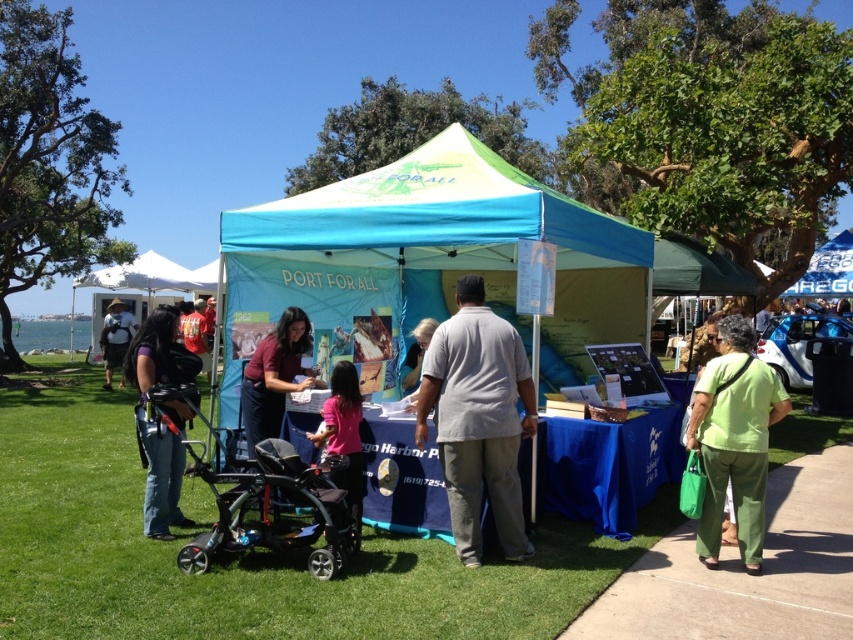
Question: Which object is the closest to the blue fabric tent at center?

Choices:
 (A) green fabric bag at lower right
 (B) matte black backpack at center
 (C) blue fabric canopy at upper center
 (D) pink matte shirt at center

Answer: (D)

Question: Which is nearer to the black textured stroller at center?

Choices:
 (A) light brown fabric shirt at center
 (B) gray cotton shirt at center
 (C) pink matte shirt at center
 (D) maroon fabric shirt at center

Answer: (C)

Question: Is blue fabric tent at center to the right of pink matte shirt at center from the viewer's perspective?

Choices:
 (A) yes
 (B) no

Answer: (A)

Question: Can you confirm if matte black backpack at center is positioned below light brown fabric shirt at center?

Choices:
 (A) yes
 (B) no

Answer: (A)

Question: Which of these objects is positioned farthest from the black textured stroller at center?

Choices:
 (A) pink matte shirt at center
 (B) gray cotton shirt at center

Answer: (B)

Question: Does gray cotton shirt at center appear over matte black backpack at center?

Choices:
 (A) no
 (B) yes

Answer: (B)